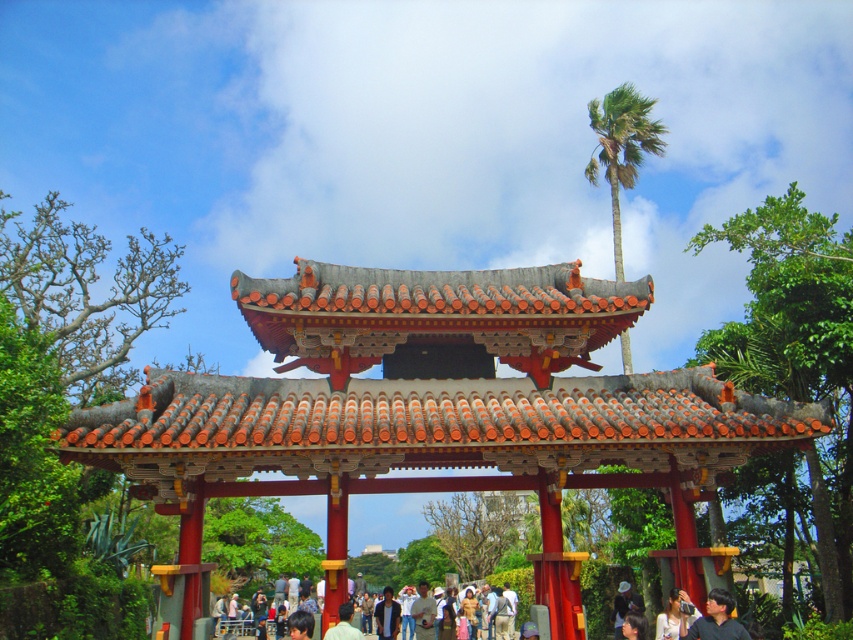
Describe the element at coordinates (434, 406) in the screenshot. The image size is (853, 640). I see `matte orange tile gate at center` at that location.

Is point (399, 378) in front of point (590, 112)?

Yes.

Identify the location of matte orange tile gate at center. (434, 406).

Does matte black shirt at lower right appear over light brown fabric bag at lower center?

Yes.

Can you confirm if matte black shirt at lower right is shorter than light brown fabric bag at lower center?

Indeed, matte black shirt at lower right has a lesser height compared to light brown fabric bag at lower center.

Who is more forward, (701, 621) or (397, 595)?

Point (701, 621) is in front.

At what (x,y) coordinates should I click in order to perform the action: click on matte black shirt at lower right. Please return your answer as a coordinate pair (x, y). The image size is (853, 640). Looking at the image, I should click on (715, 620).

Does matte black shirt at lower right appear on the left side of matte black camera at lower right?

→ Incorrect, matte black shirt at lower right is not on the left side of matte black camera at lower right.

Which is more to the left, matte black shirt at lower right or matte black camera at lower right?

matte black camera at lower right

Who is more distant from viewer, [693,634] or [669,600]?

Positioned behind is point [669,600].

The image size is (853, 640). Find the location of `matte black shirt at lower right`. matte black shirt at lower right is located at coordinates (715, 620).